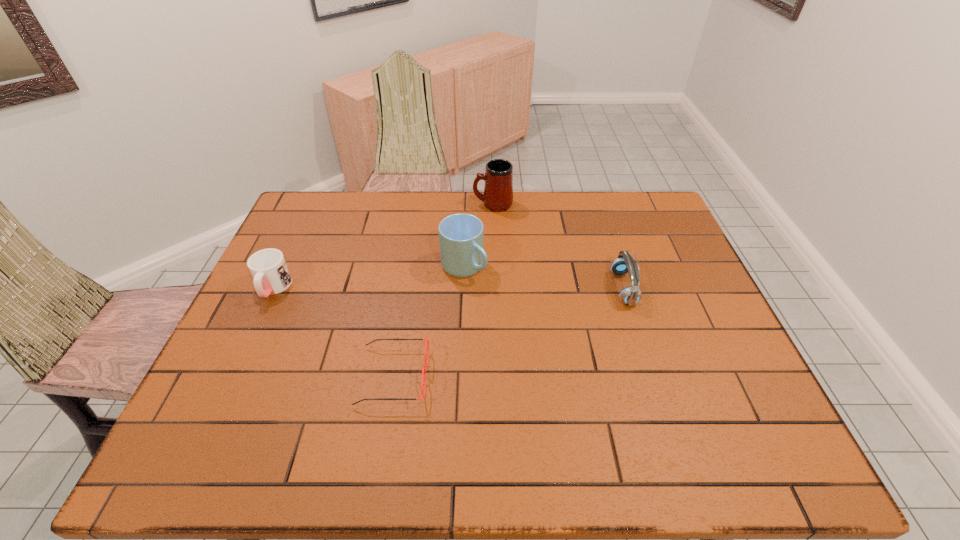
Locate an element on the screen. The image size is (960, 540). mug that can be found as the closest to the leftmost object is located at coordinates (461, 236).

Choose which mug is the second nearest neighbor to the leftmost mug. Please provide its 2D coordinates. Your answer should be formatted as a tuple, i.e. [(x, y)], where the tuple contains the x and y coordinates of a point satisfying the conditions above.

[(498, 190)]

Identify the location of vacant position in the image that satisfies the following two spatial constraints: 1. on the side of the farthest object with the handle; 2. on the side of the leftmost mug with the handle. The image size is (960, 540). (496, 288).